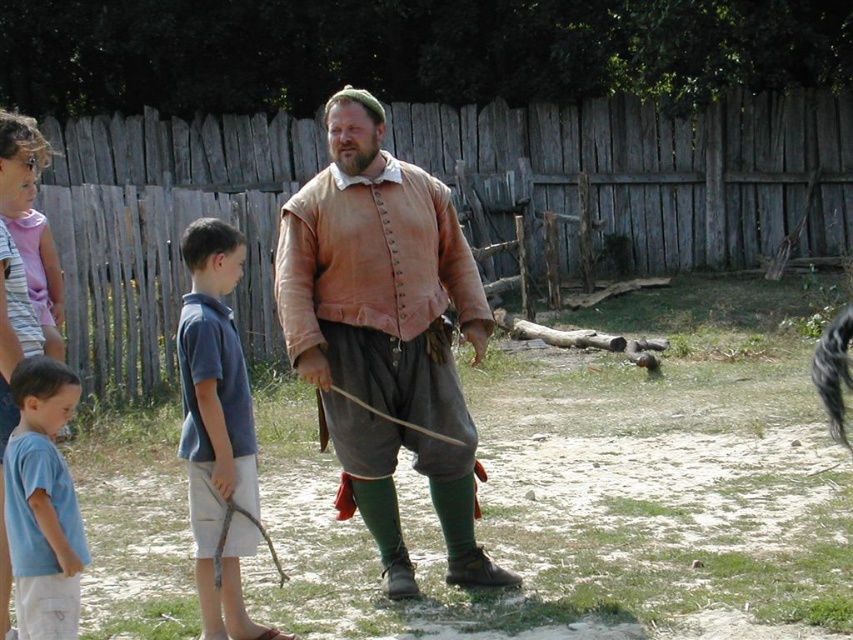
Which is in front, point (263, 208) or point (20, 500)?

Positioned in front is point (20, 500).

Identify the location of wooden at center. The width and height of the screenshot is (853, 640). (648, 173).

Which is in front, point (785, 218) or point (28, 358)?

Point (28, 358) is in front.

You are a GUI agent. You are given a task and a screenshot of the screen. Output one action in this format:
    pyautogui.click(x=<x>, y=<y>)
    Task: Click on the wooden at center
    The image size is (853, 640).
    Given the screenshot: What is the action you would take?
    pyautogui.click(x=648, y=173)

Is leather jacket at center positioned behind light blue t-shirt at lower left?

Yes, leather jacket at center is behind light blue t-shirt at lower left.

Where is `leather jacket at center`? This screenshot has height=640, width=853. leather jacket at center is located at coordinates (386, 332).

The width and height of the screenshot is (853, 640). Describe the element at coordinates (386, 332) in the screenshot. I see `leather jacket at center` at that location.

This screenshot has height=640, width=853. I want to click on leather jacket at center, so click(386, 332).

Does blue cotton shirt at center appear on the right side of light blue t-shirt at lower left?

Indeed, blue cotton shirt at center is positioned on the right side of light blue t-shirt at lower left.

Can you confirm if blue cotton shirt at center is wider than light blue t-shirt at lower left?

Indeed, blue cotton shirt at center has a greater width compared to light blue t-shirt at lower left.

Locate an element on the screen. blue cotton shirt at center is located at coordinates (218, 428).